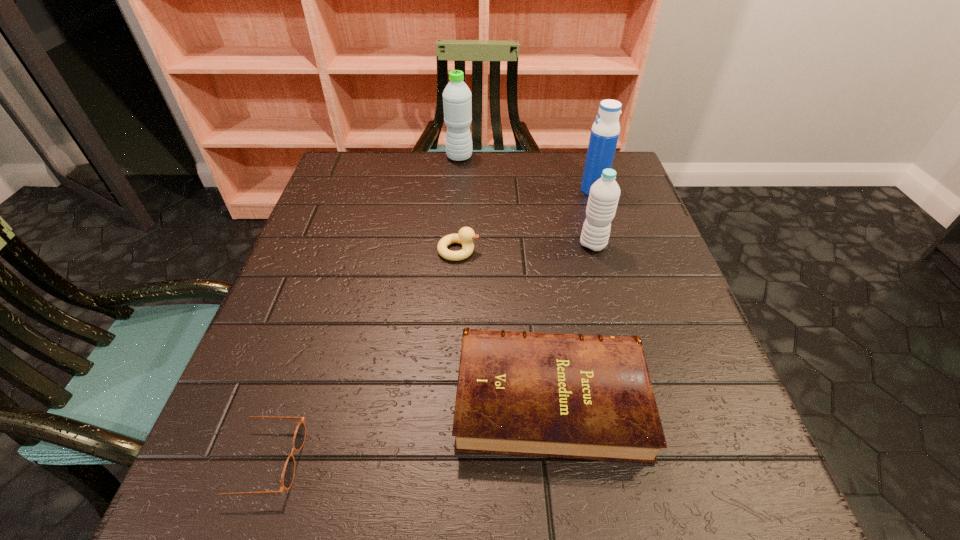
At what (x,y) coordinates should I click in order to perform the action: click on the farthest object. Please return your answer as a coordinate pair (x, y). This screenshot has width=960, height=540. Looking at the image, I should click on (457, 103).

I want to click on the leftmost water bottle, so click(457, 103).

Find the location of a particular element. The height and width of the screenshot is (540, 960). the second farthest water bottle is located at coordinates (605, 131).

Locate an element on the screen. This screenshot has height=540, width=960. the shortest water bottle is located at coordinates (604, 194).

Image resolution: width=960 pixels, height=540 pixels. Identify the location of the nearest water bottle. (604, 194).

The image size is (960, 540). What are the coordinates of `duckling` in the screenshot? It's located at (466, 235).

Find the location of a particular element. The width and height of the screenshot is (960, 540). hardback book is located at coordinates (590, 397).

Find the location of a particular element. Image resolution: width=960 pixels, height=540 pixels. the shortest object is located at coordinates (288, 473).

Locate an element on the screen. The image size is (960, 540). sunglasses is located at coordinates (288, 473).

Identify the location of free space located on the left of the farthest object. This screenshot has height=540, width=960. (369, 157).